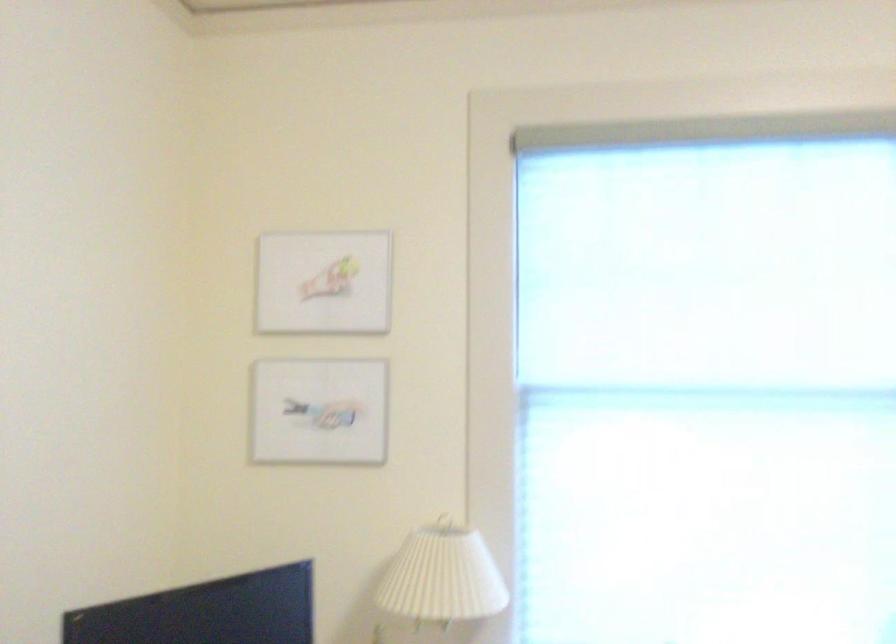
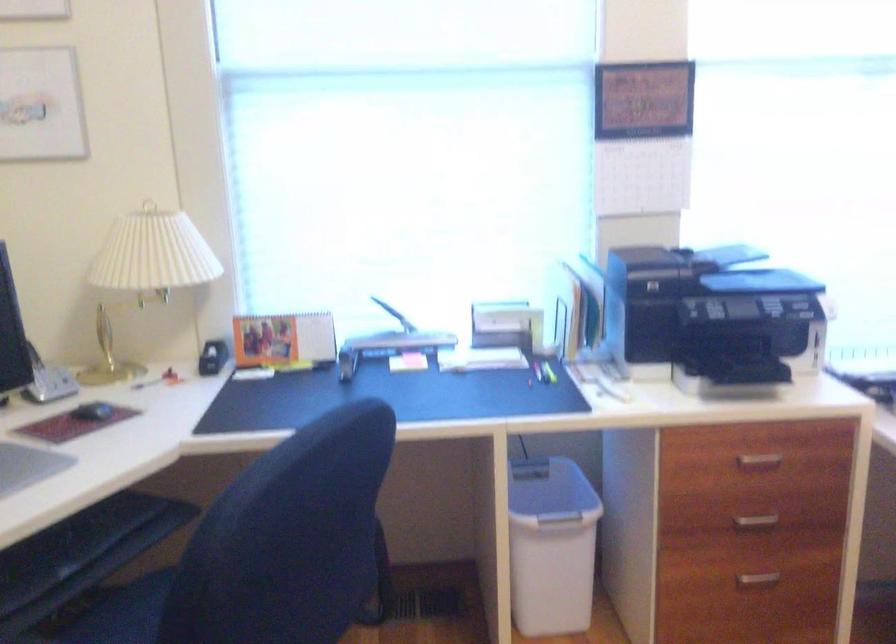
What movement of the cameraman would produce the second image?

The cameraman walked toward right, backward.